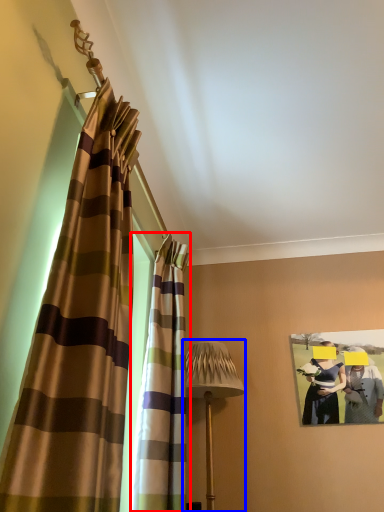
Question: Which point is further to the camera, curtain (highlighted by a red box) or table lamp (highlighted by a blue box)?

Choices:
 (A) curtain
 (B) table lamp

Answer: (B)